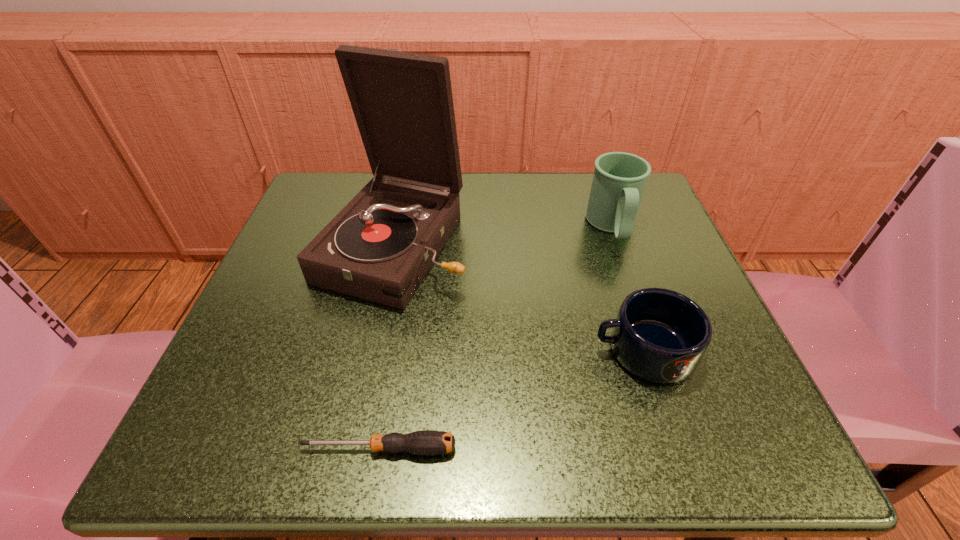
I want to click on free space located with the handle on the side of the shorter mug, so click(334, 350).

Where is `free spot located 0.350m with the handle on the side of the shorter mug`? This screenshot has width=960, height=540. free spot located 0.350m with the handle on the side of the shorter mug is located at coordinates (361, 350).

Image resolution: width=960 pixels, height=540 pixels. I want to click on vacant space situated on the back of the screwdriver, so click(413, 247).

At what (x,y) coordinates should I click in order to perform the action: click on phonograph record situated at the far edge. Please return your answer as a coordinate pair (x, y). Image resolution: width=960 pixels, height=540 pixels. Looking at the image, I should click on (379, 247).

The image size is (960, 540). In order to click on mug at the far edge in this screenshot , I will do pos(619,179).

Identify the location of object located at the near edge. (425, 442).

Where is `phonograph record at the left edge`? This screenshot has height=540, width=960. phonograph record at the left edge is located at coordinates (379, 247).

Identify the location of screwdriver that is at the left edge. This screenshot has height=540, width=960. (425, 442).

The image size is (960, 540). In order to click on object that is positioned at the far left corner in this screenshot , I will do `click(379, 247)`.

Find the location of a particular element. Image resolution: width=960 pixels, height=540 pixels. object at the near left corner is located at coordinates [425, 442].